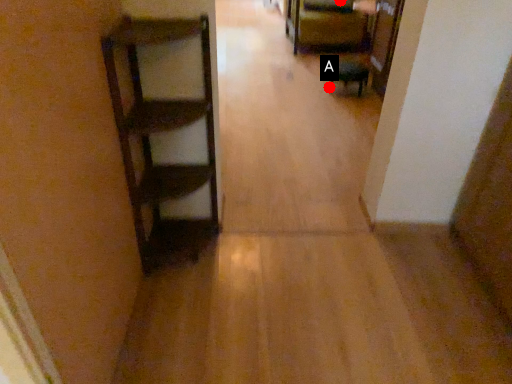
Question: Two points are circled on the image, labeled by A and B beside each circle. Which point is farther to the camera?

Choices:
 (A) A is further
 (B) B is further

Answer: (B)